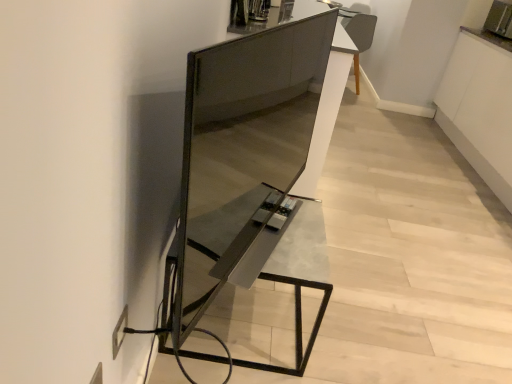
Identify the location of metallic silver toaster at upper right. (500, 19).

Describe the element at coordinates (268, 254) in the screenshot. I see `metallic gray table at center` at that location.

Identify the location of satin black tv stand at center. The width and height of the screenshot is (512, 384). coord(253,172).

Find the location of `metallic silver toaster at upper right`. metallic silver toaster at upper right is located at coordinates (500, 19).

Is satin black tv stand at center to the left or to the right of metallic silver toaster at upper right in the image?

satin black tv stand at center is to the left of metallic silver toaster at upper right.

From the picture: From a real-world perspective, does satin black tv stand at center stand above metallic silver toaster at upper right?

Incorrect, from a real-world perspective, satin black tv stand at center is lower than metallic silver toaster at upper right.

In the image, is satin black tv stand at center positioned in front of or behind metallic silver toaster at upper right?

satin black tv stand at center is in front of metallic silver toaster at upper right.

How many degrees apart are the facing directions of satin black tv stand at center and metallic silver toaster at upper right?

satin black tv stand at center and metallic silver toaster at upper right are facing 161 degrees away from each other.

From the image's perspective, which one is positioned lower, metallic silver toaster at upper right or metallic gray table at center?

metallic gray table at center is shown below in the image.

Which object is positioned more to the left, metallic silver toaster at upper right or metallic gray table at center?

From the viewer's perspective, metallic gray table at center appears more on the left side.

Would you say metallic silver toaster at upper right is outside metallic gray table at center?

metallic silver toaster at upper right lies outside metallic gray table at center's area.

Is metallic silver toaster at upper right with metallic gray table at center?

No, metallic silver toaster at upper right is not touching metallic gray table at center.

In terms of width, does metallic gray table at center look wider or thinner when compared to metallic silver toaster at upper right?

Clearly, metallic gray table at center has more width compared to metallic silver toaster at upper right.

Which point is more forward, (254, 230) or (498, 13)?

The point (254, 230) is more forward.

The image size is (512, 384). Identify the location of appliance located on the right of metallic gray table at center. (500, 19).

Are satin black tv stand at center and metallic gray table at center far apart?

No, satin black tv stand at center is not far from metallic gray table at center.

Consider the image. Which is closer, (265, 110) or (223, 210)?

Point (265, 110) is farther from the camera than point (223, 210).

In terms of height, does satin black tv stand at center look taller or shorter compared to metallic gray table at center?

Considering their sizes, satin black tv stand at center has more height than metallic gray table at center.

In the scene shown: Is satin black tv stand at center turned away from metallic gray table at center?

satin black tv stand at center does not have its back to metallic gray table at center.

Is metallic gray table at center bigger or smaller than satin black tv stand at center?

Considering their sizes, metallic gray table at center takes up more space than satin black tv stand at center.

Can you confirm if metallic gray table at center is positioned to the right of satin black tv stand at center?

No, metallic gray table at center is not to the right of satin black tv stand at center.

Considering the sizes of objects metallic gray table at center and satin black tv stand at center in the image provided, who is shorter, metallic gray table at center or satin black tv stand at center?

metallic gray table at center is shorter.

Considering the points (240, 218) and (278, 372), which point is in front, point (240, 218) or point (278, 372)?

The point (240, 218) is closer.

Is point (505, 27) more distant than point (314, 242)?

Yes, it is.

Is metallic silver toaster at upper right in contact with satin black tv stand at center?

No, metallic silver toaster at upper right is not making contact with satin black tv stand at center.

From a real-world perspective, who is located higher, metallic silver toaster at upper right or satin black tv stand at center?

metallic silver toaster at upper right, from a real-world perspective.

How much distance is there between metallic silver toaster at upper right and satin black tv stand at center?

metallic silver toaster at upper right is 10.15 feet from satin black tv stand at center.

Identify the location of appliance to the right of satin black tv stand at center. The image size is (512, 384). (500, 19).

The image size is (512, 384). Find the location of `table below the metallic silver toaster at upper right (from a real-world perspective)`. table below the metallic silver toaster at upper right (from a real-world perspective) is located at coordinates (268, 254).

Which object lies further to the anchor point satin black tv stand at center, metallic silver toaster at upper right or metallic gray table at center?

metallic silver toaster at upper right is positioned further to the anchor satin black tv stand at center.

From the image, which object appears to be nearer to metallic silver toaster at upper right, metallic gray table at center or satin black tv stand at center?

satin black tv stand at center.

From the image, which object appears to be farther from satin black tv stand at center, metallic gray table at center or metallic silver toaster at upper right?

The object further to satin black tv stand at center is metallic silver toaster at upper right.

From the image, which object appears to be farther from metallic silver toaster at upper right, satin black tv stand at center or metallic gray table at center?

Among the two, metallic gray table at center is located further to metallic silver toaster at upper right.

Based on the photo, from the image, which object appears to be nearer to metallic gray table at center, satin black tv stand at center or metallic silver toaster at upper right?

satin black tv stand at center.

Estimate the real-world distances between objects in this image. Which object is closer to metallic gray table at center, metallic silver toaster at upper right or satin black tv stand at center?

satin black tv stand at center lies closer to metallic gray table at center than the other object.

You are a GUI agent. You are given a task and a screenshot of the screen. Output one action in this format:
    pyautogui.click(x=<x>, y=<y>)
    Task: Click on the table between satin black tv stand at center and metallic silver toaster at upper right from front to back
    
    Given the screenshot: What is the action you would take?
    pyautogui.click(x=268, y=254)